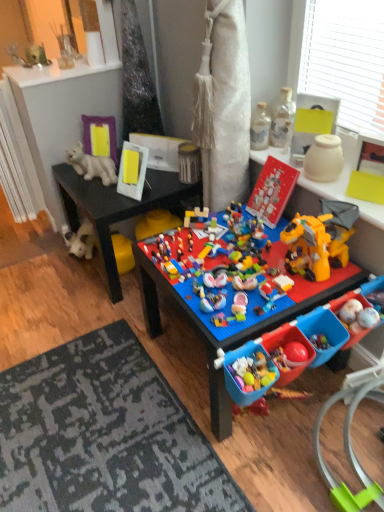
Where is `unoccupied area in front of black matte desk at center`? unoccupied area in front of black matte desk at center is located at coordinates (98, 333).